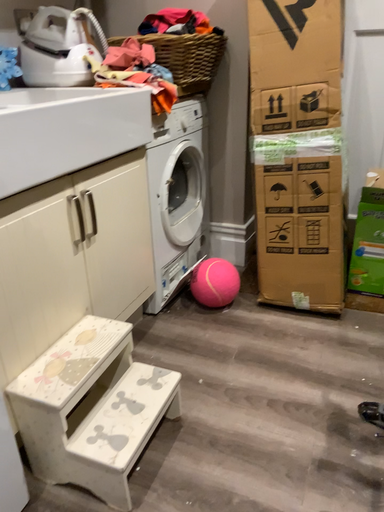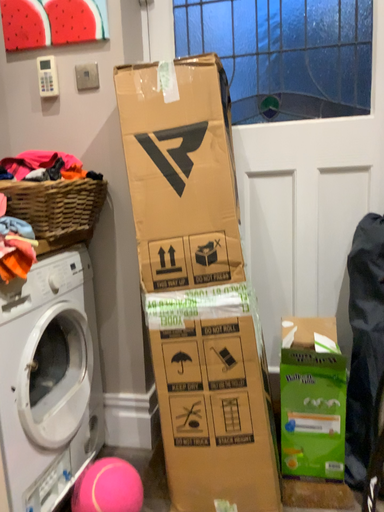
Question: Which way did the camera rotate in the video?

Choices:
 (A) rotated left
 (B) rotated right

Answer: (B)